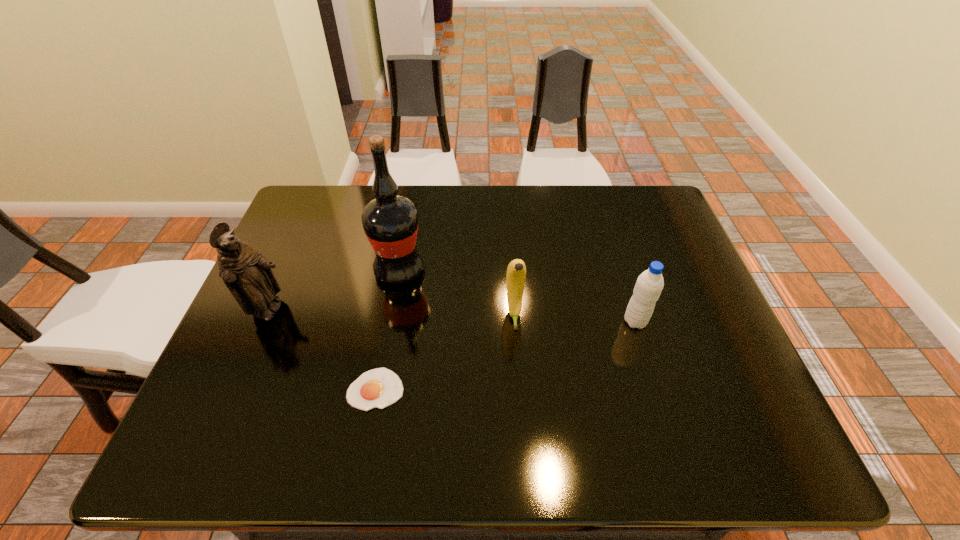
The width and height of the screenshot is (960, 540). I want to click on free point between the banana and the egg yolk, so click(x=445, y=352).

Locate an element on the screen. Image resolution: width=960 pixels, height=540 pixels. vacant area that lies between the tallest object and the second object from right to left is located at coordinates (457, 292).

At what (x,y) coordinates should I click in order to perform the action: click on free spot between the farthest object and the figurine. Please return your answer as a coordinate pair (x, y). Image resolution: width=960 pixels, height=540 pixels. Looking at the image, I should click on (335, 291).

I want to click on free space between the fourth object from left to right and the farthest object, so click(457, 292).

Find the location of `free space between the nearest object and the figurine`. free space between the nearest object and the figurine is located at coordinates (323, 350).

I want to click on free space between the water bottle and the fourth shortest object, so point(453,316).

Find the location of a particular element. empty space between the nearest object and the water bottle is located at coordinates (506, 355).

The height and width of the screenshot is (540, 960). Identify the location of free spot between the banana and the second tallest object. (392, 313).

Locate an element on the screen. This screenshot has height=540, width=960. vacant space in between the water bottle and the figurine is located at coordinates (453, 316).

Locate which object ranks third in proximity to the water bottle. Please provide its 2D coordinates. Your answer should be formatted as a tuple, i.e. [(x, y)], where the tuple contains the x and y coordinates of a point satisfying the conditions above.

[(379, 388)]